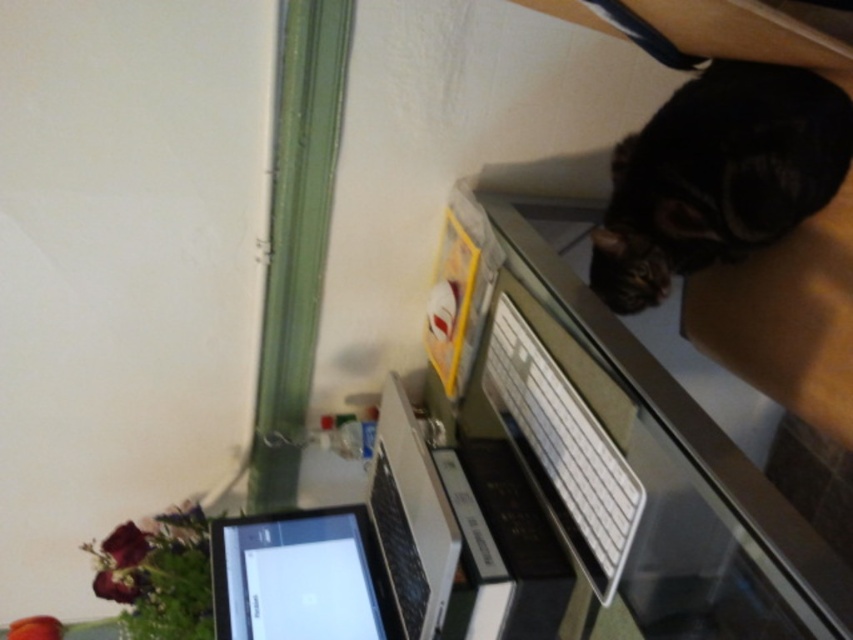
Question: Which point is closer to the camera taking this photo?

Choices:
 (A) (345, 547)
 (B) (672, 120)

Answer: (B)

Question: Among these objects, which one is farthest from the camera?

Choices:
 (A) satin black laptop at lower left
 (B) black glossy tablet at lower left

Answer: (B)

Question: Is white plastic keyboard at upper right behind black fur cat at upper right?

Choices:
 (A) yes
 (B) no

Answer: (B)

Question: Does white plastic keyboard at upper right have a lesser width compared to satin black laptop at lower left?

Choices:
 (A) no
 (B) yes

Answer: (B)

Question: Is the position of satin black laptop at lower left less distant than that of black glossy tablet at lower left?

Choices:
 (A) yes
 (B) no

Answer: (A)

Question: Among these points, which one is nearest to the camera?

Choices:
 (A) (352, 637)
 (B) (802, 163)

Answer: (B)